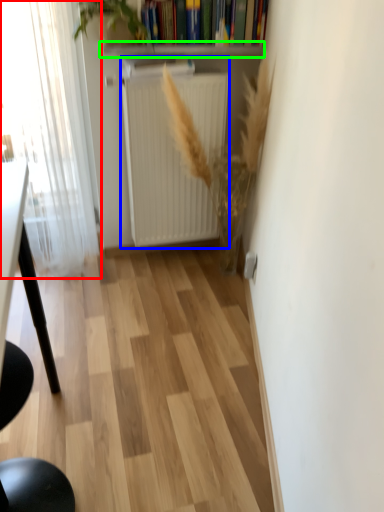
Question: Based on their relative distances, which object is nearer to window (highlighted by a red box)? Choose from radiator (highlighted by a blue box) and window sill (highlighted by a green box).

Choices:
 (A) radiator
 (B) window sill

Answer: (A)